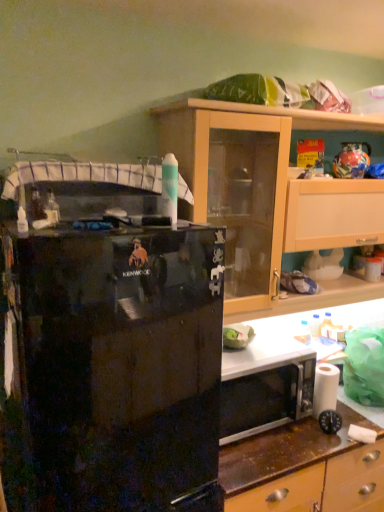
Question: Is the surface of black glossy refrigerator at left in direct contact with light wood cabinet at upper right?

Choices:
 (A) no
 (B) yes

Answer: (A)

Question: Does black glossy refrigerator at left have a smaller size compared to light wood cabinet at upper right?

Choices:
 (A) yes
 (B) no

Answer: (B)

Question: Is black glossy refrigerator at left not inside light wood cabinet at upper right?

Choices:
 (A) no
 (B) yes

Answer: (B)

Question: Considering the relative sizes of black glossy refrigerator at left and light wood cabinet at upper right in the image provided, is black glossy refrigerator at left wider than light wood cabinet at upper right?

Choices:
 (A) no
 (B) yes

Answer: (B)

Question: Considering the relative positions of black glossy refrigerator at left and light wood cabinet at upper right in the image provided, is black glossy refrigerator at left in front of light wood cabinet at upper right?

Choices:
 (A) no
 (B) yes

Answer: (B)

Question: Is black glossy refrigerator at left spatially inside white matte toilet paper at lower right, or outside of it?

Choices:
 (A) inside
 (B) outside

Answer: (B)

Question: Is black glossy refrigerator at left in front of or behind white matte toilet paper at lower right in the image?

Choices:
 (A) front
 (B) behind

Answer: (A)

Question: Is point (137, 399) positioned closer to the camera than point (316, 397)?

Choices:
 (A) closer
 (B) farther

Answer: (A)

Question: From a real-world perspective, is black glossy refrigerator at left physically located above or below white matte toilet paper at lower right?

Choices:
 (A) above
 (B) below

Answer: (A)

Question: Is light wood cabinet at upper right in front of or behind white matte toilet paper at lower right in the image?

Choices:
 (A) behind
 (B) front

Answer: (B)

Question: Based on their sizes in the image, would you say light wood cabinet at upper right is bigger or smaller than white matte toilet paper at lower right?

Choices:
 (A) small
 (B) big

Answer: (B)

Question: Is point (230, 280) positioned closer to the camera than point (314, 388)?

Choices:
 (A) closer
 (B) farther

Answer: (B)

Question: From a real-world perspective, is light wood cabinet at upper right above or below white matte toilet paper at lower right?

Choices:
 (A) below
 (B) above

Answer: (B)

Question: Considering the positions of black glossy refrigerator at left and light wood cabinet at upper right in the image, is black glossy refrigerator at left wider or thinner than light wood cabinet at upper right?

Choices:
 (A) wide
 (B) thin

Answer: (A)

Question: In terms of size, does black glossy refrigerator at left appear bigger or smaller than light wood cabinet at upper right?

Choices:
 (A) small
 (B) big

Answer: (B)